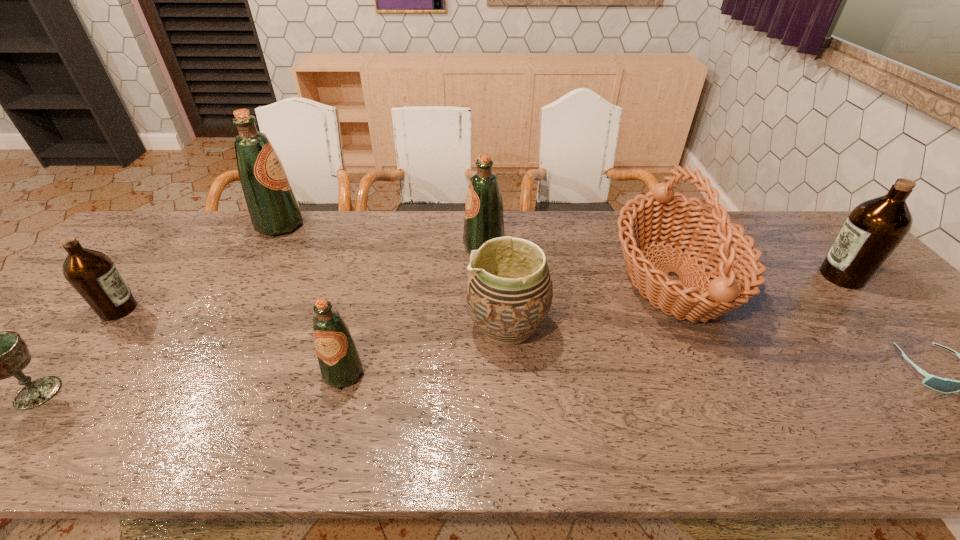
Locate an element on the screen. Image resolution: width=960 pixels, height=540 pixels. free region located 0.210m on the label of the right brown olive oil is located at coordinates 745,276.

Where is `vacant space located 0.060m on the front of the pottery`? This screenshot has height=540, width=960. vacant space located 0.060m on the front of the pottery is located at coordinates (511, 379).

The height and width of the screenshot is (540, 960). Find the location of `free space located on the front-facing side of the second green olive oil from right to left`. free space located on the front-facing side of the second green olive oil from right to left is located at coordinates (324, 443).

Identify the location of vacant region located on the label of the smaller brown olive oil. Image resolution: width=960 pixels, height=540 pixels. (225, 309).

At what (x,y) coordinates should I click in order to perform the action: click on basket located at the far edge. Please return your answer as a coordinate pair (x, y). This screenshot has height=540, width=960. Looking at the image, I should click on (671, 216).

Where is `object present at the left edge`? This screenshot has width=960, height=540. object present at the left edge is located at coordinates (91, 273).

Find the location of a particular element. The height and width of the screenshot is (540, 960). object that is at the right edge is located at coordinates (873, 230).

At what (x,y) coordinates should I click in order to perform the action: click on blank space at the far edge of the desktop. Please return your answer as a coordinate pair (x, y). The image size is (960, 540). Looking at the image, I should click on (245, 225).

In the image, there is a desktop. Find the location of `free space at the left edge`. free space at the left edge is located at coordinates (55, 328).

Find the location of `free spot between the third olive oil from right to left and the leftmost green olive oil`. free spot between the third olive oil from right to left and the leftmost green olive oil is located at coordinates (312, 299).